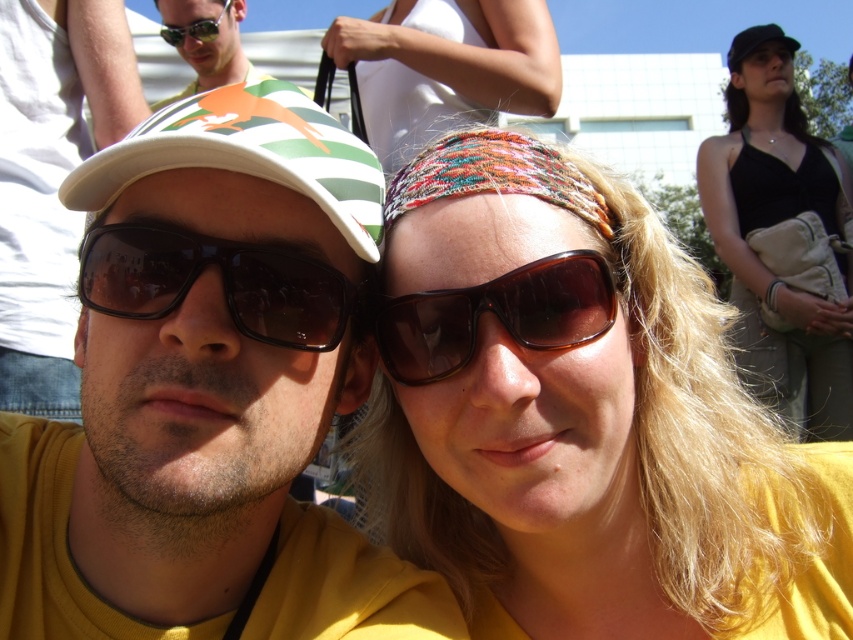
Between multicolored woven headband at center and black plastic sunglasses at center, which one has more height?

multicolored woven headband at center

Is point (671, 582) positioned behind point (137, 296)?

Yes.

At what (x,y) coordinates should I click in order to perform the action: click on multicolored woven headband at center. Please return your answer as a coordinate pair (x, y). This screenshot has width=853, height=640. Looking at the image, I should click on (582, 417).

Is point (509, 324) farther from camera compared to point (750, 51)?

That is False.

Does brown textured sunglasses at center have a greater height compared to black fabric cap at upper right?

No.

Locate an element on the screen. This screenshot has height=640, width=853. brown textured sunglasses at center is located at coordinates (495, 316).

Between black fabric tank top at upper right and green and white striped baseball cap at left, which one is positioned lower?

green and white striped baseball cap at left is below.

Image resolution: width=853 pixels, height=640 pixels. What do you see at coordinates (781, 240) in the screenshot?
I see `black fabric tank top at upper right` at bounding box center [781, 240].

This screenshot has height=640, width=853. What are the coordinates of `black fabric tank top at upper right` in the screenshot? It's located at (781, 240).